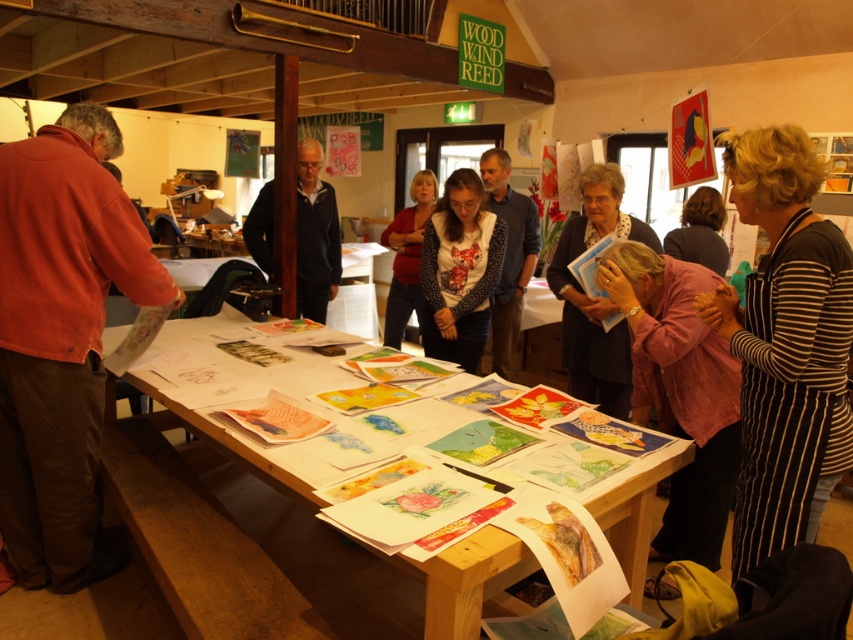
Question: Can you confirm if white dotted shirt at center is positioned above dark brown hair at center?

Choices:
 (A) yes
 (B) no

Answer: (B)

Question: Does wooden table at center appear over black dotted shirt at center?

Choices:
 (A) yes
 (B) no

Answer: (B)

Question: Estimate the real-world distances between objects in this image. Which object is farther from the matte black jacket at center?

Choices:
 (A) matte red shirt at left
 (B) striped fabric dress at center
 (C) pink fabric at center

Answer: (A)

Question: Is pink fabric at center below black dotted shirt at center?

Choices:
 (A) no
 (B) yes

Answer: (B)

Question: Considering the real-world distances, which object is farthest from the dark blue sweater at center?

Choices:
 (A) matte red sweater at center
 (B) matte red shirt at left

Answer: (B)

Question: Which of the following is the farthest from the observer?

Choices:
 (A) pos(221,435)
 (B) pos(520,228)
 (C) pos(582,177)

Answer: (B)